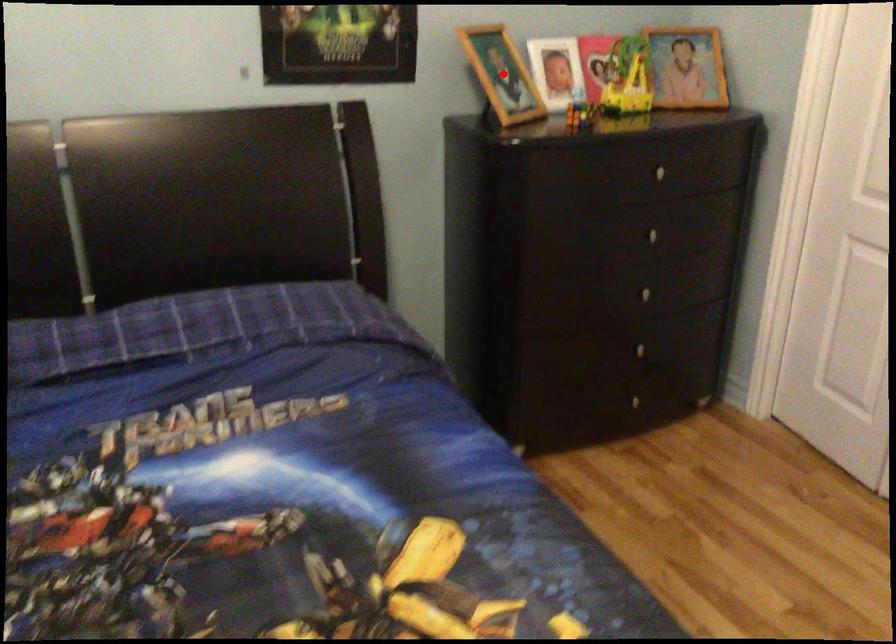
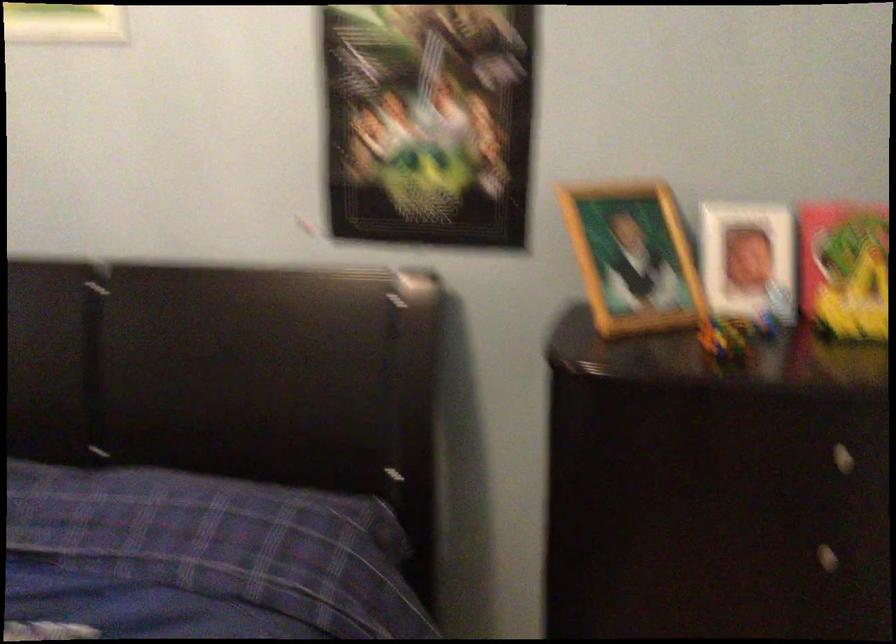
In the second image, find the point that corresponds to the highlighted location in the first image.

(633, 258)